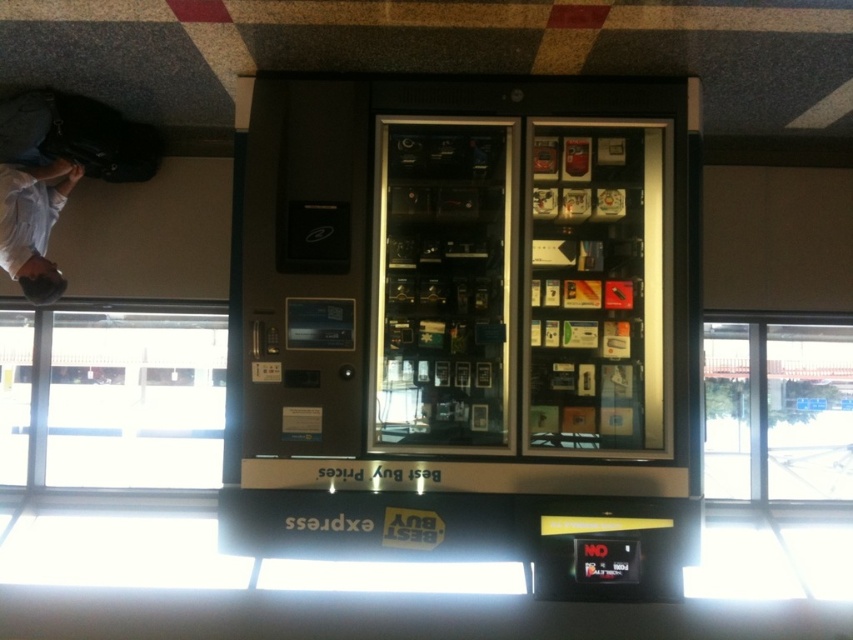
You are standing in front of the Best Buy Express vending machine and need to determine if you can fit a large backpack between the metallic gray vending machine at center and the white fabric at upper left. Can you fit your backpack there?

The metallic gray vending machine at center might be wider than white fabric at upper left, so it is uncertain if there is enough space to fit a large backpack between them. Check the actual distance before attempting to place your backpack.

You are standing in front of the Best Buy Express vending machine and want to reach the white fabric at upper left. Is the metallic gray vending machine at center blocking your direct path to it?

The metallic gray vending machine at center is closer to the viewer than the white fabric at upper left, so it would block the direct path to the white fabric at upper left.